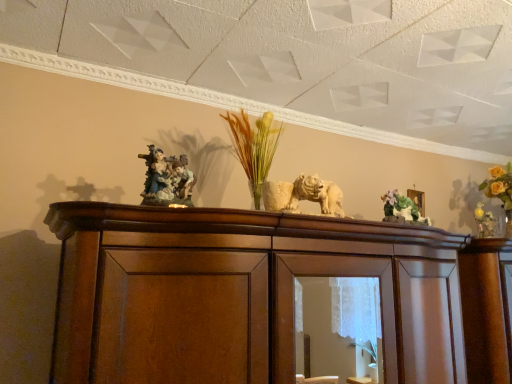
Question: From the image's perspective, is matte porcelain figurine at center over green matte floral arrangement at upper right?

Choices:
 (A) no
 (B) yes

Answer: (B)

Question: Considering the relative sizes of matte porcelain figurine at center and green matte floral arrangement at upper right in the image provided, is matte porcelain figurine at center taller than green matte floral arrangement at upper right?

Choices:
 (A) no
 (B) yes

Answer: (B)

Question: From a real-world perspective, does matte porcelain figurine at center sit lower than green matte floral arrangement at upper right?

Choices:
 (A) no
 (B) yes

Answer: (A)

Question: Is matte porcelain figurine at center in contact with green matte floral arrangement at upper right?

Choices:
 (A) no
 (B) yes

Answer: (A)

Question: Does matte porcelain figurine at center turn towards green matte floral arrangement at upper right?

Choices:
 (A) yes
 (B) no

Answer: (B)

Question: Is green matte floral arrangement at upper right a part of matte porcelain figurine at center?

Choices:
 (A) yes
 (B) no

Answer: (B)

Question: Considering the relative sizes of green matte floral arrangement at upper right and matte porcelain figurine at center in the image provided, is green matte floral arrangement at upper right taller than matte porcelain figurine at center?

Choices:
 (A) yes
 (B) no

Answer: (B)

Question: From a real-world perspective, does green matte floral arrangement at upper right stand above matte porcelain figurine at center?

Choices:
 (A) no
 (B) yes

Answer: (A)

Question: Does green matte floral arrangement at upper right touch matte porcelain figurine at center?

Choices:
 (A) no
 (B) yes

Answer: (A)

Question: Can you confirm if green matte floral arrangement at upper right is shorter than matte porcelain figurine at center?

Choices:
 (A) no
 (B) yes

Answer: (B)

Question: Does green matte floral arrangement at upper right have a smaller size compared to matte porcelain figurine at center?

Choices:
 (A) no
 (B) yes

Answer: (B)

Question: Is green matte floral arrangement at upper right wider than matte porcelain figurine at center?

Choices:
 (A) no
 (B) yes

Answer: (A)

Question: Visually, is matte porcelain figurine at center positioned to the left or to the right of green matte floral arrangement at upper right?

Choices:
 (A) left
 (B) right

Answer: (A)